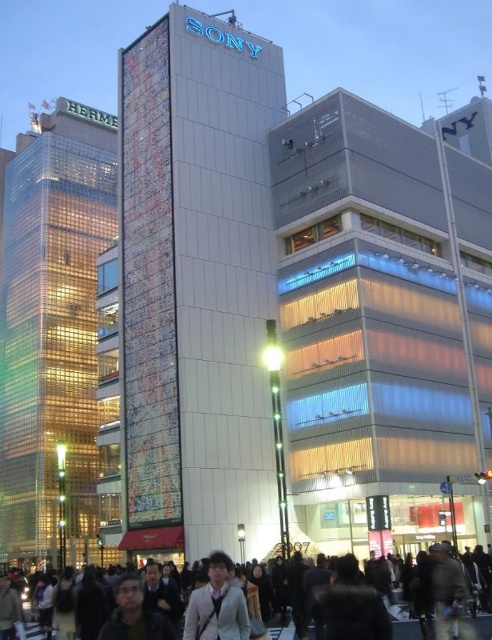
Question: Does light brown leather jacket at center appear on the right side of dark clothing crowd at center?

Choices:
 (A) no
 (B) yes

Answer: (B)

Question: Observing the image, what is the correct spatial positioning of light brown leather jacket at center in reference to dark clothing crowd at center?

Choices:
 (A) left
 (B) right

Answer: (B)

Question: Can you confirm if light brown leather jacket at center is thinner than dark clothing crowd at center?

Choices:
 (A) yes
 (B) no

Answer: (A)

Question: Which point is closer to the camera?

Choices:
 (A) light brown leather jacket at center
 (B) dark clothing crowd at center

Answer: (A)

Question: Which point is farther to the camera?

Choices:
 (A) light brown leather jacket at center
 (B) dark clothing crowd at center

Answer: (B)